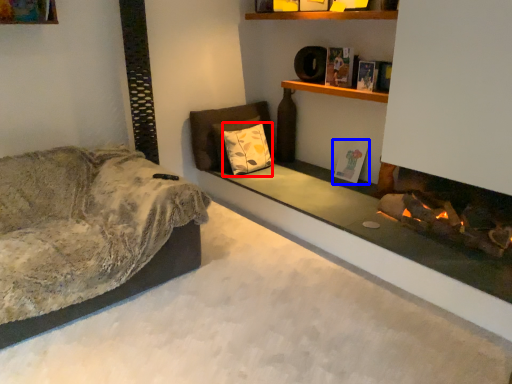
Question: Which object is further to the camera taking this photo, pillow (highlighted by a red box) or book (highlighted by a blue box)?

Choices:
 (A) pillow
 (B) book

Answer: (A)